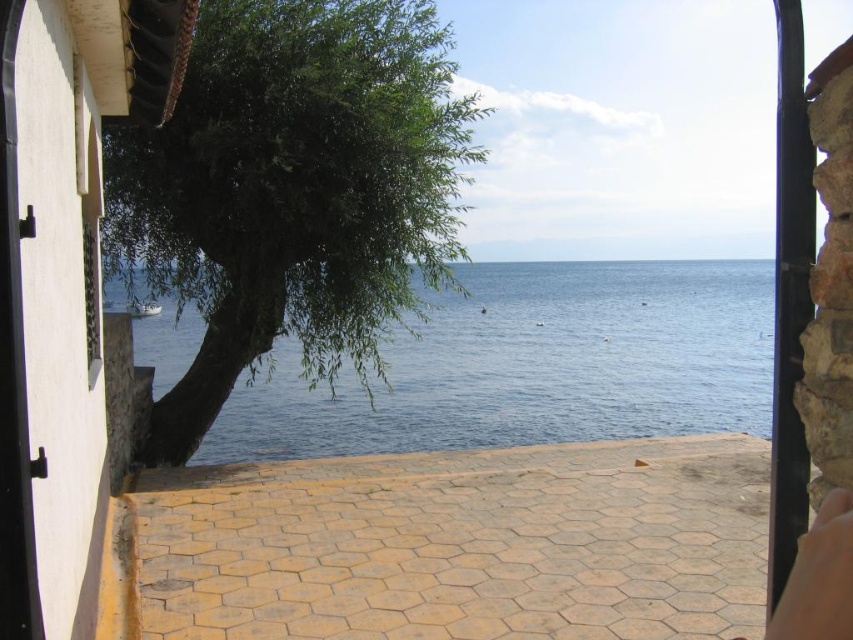
Question: Estimate the real-world distances between objects in this image. Which object is closer to the smooth skin at lower right?

Choices:
 (A) green leafy tree at left
 (B) blue water at center

Answer: (A)

Question: Does green leafy tree at left come behind smooth skin at lower right?

Choices:
 (A) no
 (B) yes

Answer: (B)

Question: Observing the image, what is the correct spatial positioning of green leafy tree at left in reference to blue water at center?

Choices:
 (A) above
 (B) below

Answer: (B)

Question: In this image, where is blue water at center located relative to smooth skin at lower right?

Choices:
 (A) above
 (B) below

Answer: (A)

Question: Which point is farther to the camera?

Choices:
 (A) (322, 451)
 (B) (840, 596)
 (C) (183, 118)

Answer: (A)

Question: Among these objects, which one is nearest to the camera?

Choices:
 (A) blue water at center
 (B) smooth skin at lower right

Answer: (B)